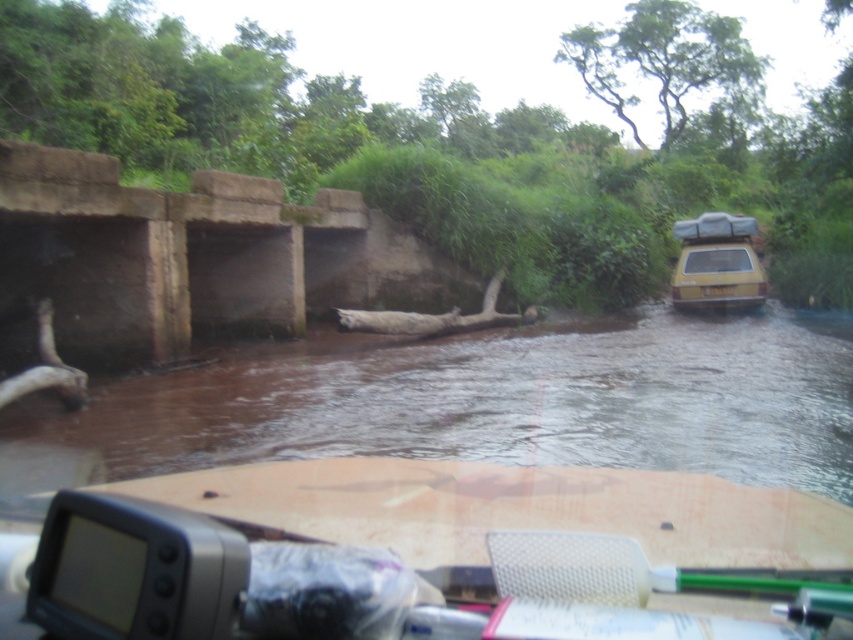
Question: Is brown muddy water at center thinner than yellow matte car at right?

Choices:
 (A) no
 (B) yes

Answer: (A)

Question: Which of the following is the farthest from the observer?

Choices:
 (A) brown muddy water at center
 (B) yellow matte car at right

Answer: (B)

Question: Does brown muddy water at center appear on the left side of yellow matte car at right?

Choices:
 (A) yes
 (B) no

Answer: (A)

Question: Among these points, which one is nearest to the camera?

Choices:
 (A) (724, 278)
 (B) (134, 419)

Answer: (B)

Question: Can you confirm if brown muddy water at center is positioned to the right of yellow matte car at right?

Choices:
 (A) yes
 (B) no

Answer: (B)